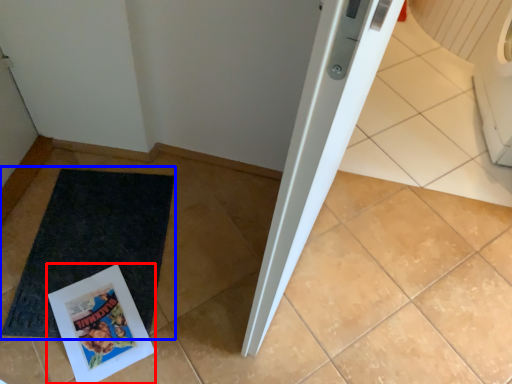
Question: Among these objects, which one is nearest to the camera, comic book (highlighted by a red box) or mat (highlighted by a blue box)?

Choices:
 (A) comic book
 (B) mat

Answer: (A)